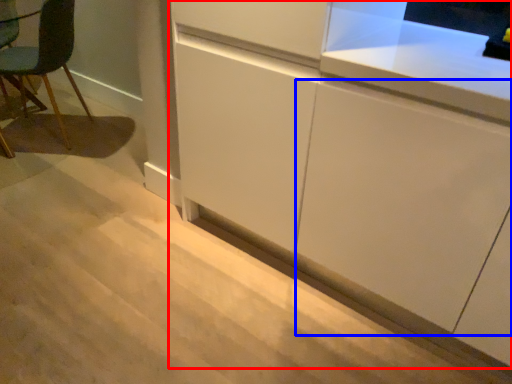
Question: Which of the following is the farthest to the observer, cabinetry (highlighted by a red box) or cabinetry (highlighted by a blue box)?

Choices:
 (A) cabinetry
 (B) cabinetry

Answer: (B)